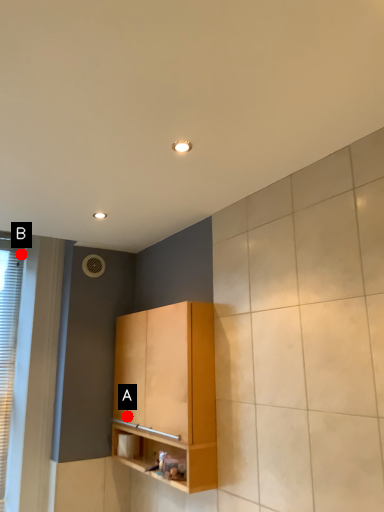
Question: Two points are circled on the image, labeled by A and B beside each circle. Which point appears farthest from the camera in this image?

Choices:
 (A) A is further
 (B) B is further

Answer: (B)